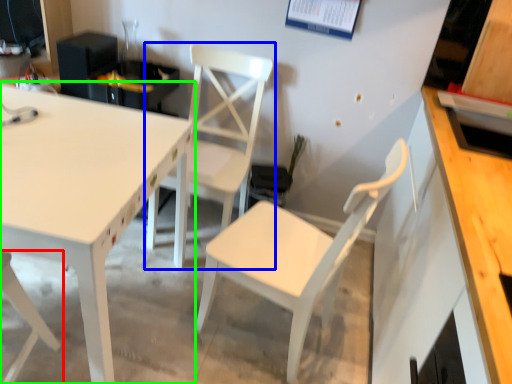
Question: Which object is the farthest from chair (highlighted by a red box)? Choose among these: chair (highlighted by a blue box) or table (highlighted by a green box).

Choices:
 (A) chair
 (B) table

Answer: (A)